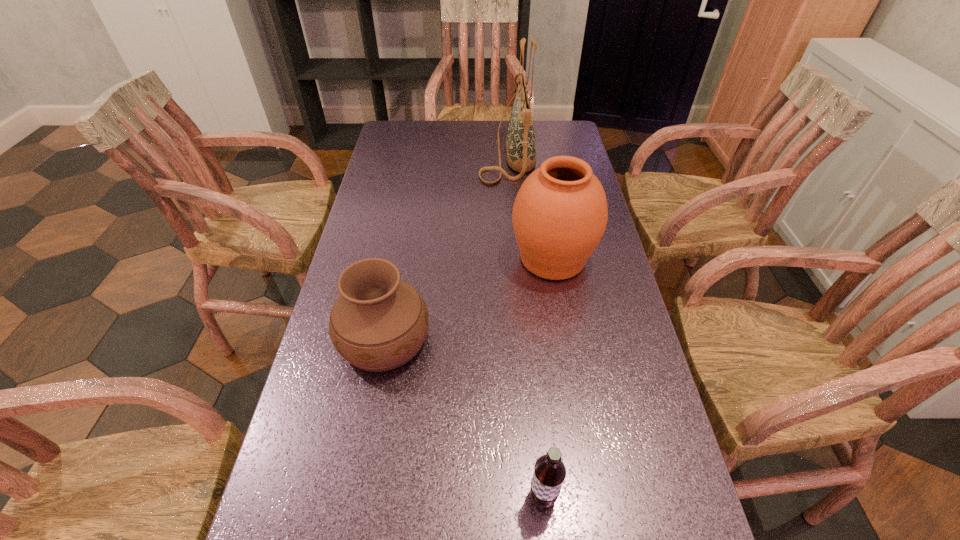
You are a GUI agent. You are given a task and a screenshot of the screen. Output one action in this format:
    pyautogui.click(x=<x>, y=<y>)
    Task: Click on the free space at the far right corner
    The width and height of the screenshot is (960, 540).
    Given the screenshot: What is the action you would take?
    pyautogui.click(x=544, y=134)

Identify the location of vacant point located between the tallest object and the root beer. (525, 325).

I want to click on free area in between the nearer urn and the tallest object, so click(445, 246).

This screenshot has height=540, width=960. In order to click on free space between the nearest object and the handbag in this screenshot , I will do `click(525, 325)`.

Where is `empty location between the third shortest object and the root beer`? Image resolution: width=960 pixels, height=540 pixels. empty location between the third shortest object and the root beer is located at coordinates (547, 377).

This screenshot has width=960, height=540. Find the location of `free point between the nearer urn and the third shortest object`. free point between the nearer urn and the third shortest object is located at coordinates (468, 299).

I want to click on free space between the root beer and the leftmost object, so click(464, 418).

This screenshot has height=540, width=960. Identify the location of free point between the third farthest object and the root beer. (464, 418).

Where is `vacant area that lies between the taller urn and the shorter urn`? The height and width of the screenshot is (540, 960). vacant area that lies between the taller urn and the shorter urn is located at coordinates (468, 299).

The height and width of the screenshot is (540, 960). In order to click on vacant area that lies between the handbag and the nearest object in this screenshot , I will do `click(525, 325)`.